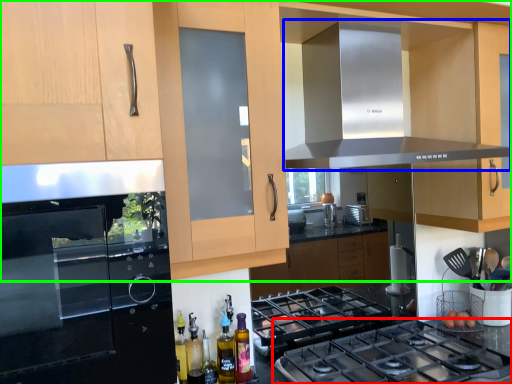
Question: Based on their relative distances, which object is nearer to gas stove (highlighted by a red box)? Choose from exhaust hood (highlighted by a blue box) and cabinetry (highlighted by a green box).

Choices:
 (A) exhaust hood
 (B) cabinetry

Answer: (B)